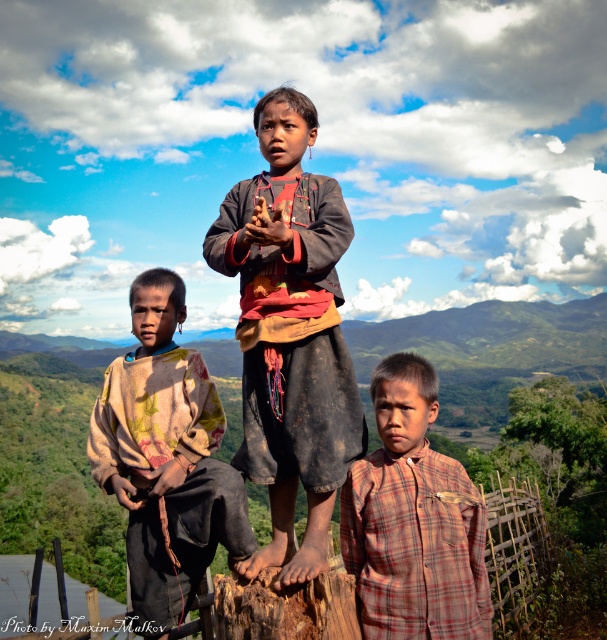
Question: Can you confirm if rustic brown shirt at left is thinner than plaid fabric shirt at lower right?

Choices:
 (A) no
 (B) yes

Answer: (A)

Question: Which of these objects is positioned farthest from the dirty brown fabric shirt at center?

Choices:
 (A) plaid fabric shirt at lower right
 (B) rustic brown shirt at left

Answer: (B)

Question: Does rustic brown shirt at left appear on the right side of plaid fabric shirt at lower right?

Choices:
 (A) no
 (B) yes

Answer: (A)

Question: Which point appears farthest from the camera in this image?

Choices:
 (A) (330, 381)
 (B) (146, 504)
 (C) (429, 368)

Answer: (B)

Question: Does dirty brown fabric shirt at center appear over rustic brown shirt at left?

Choices:
 (A) no
 (B) yes

Answer: (B)

Question: Estimate the real-world distances between objects in this image. Which object is farther from the plaid fabric shirt at lower right?

Choices:
 (A) rustic brown shirt at left
 (B) dirty brown fabric shirt at center

Answer: (A)